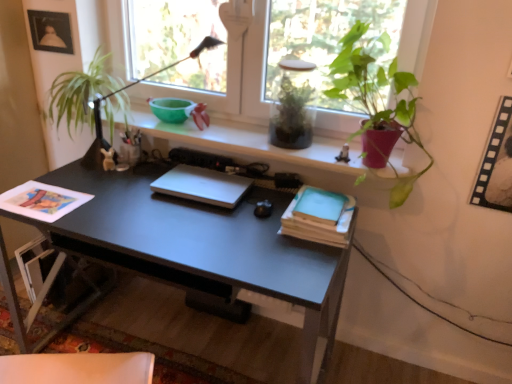
This screenshot has height=384, width=512. Identify the location of free spot in front of white matte laptop at center. (191, 223).